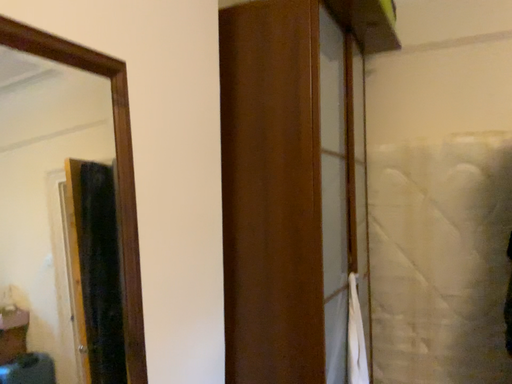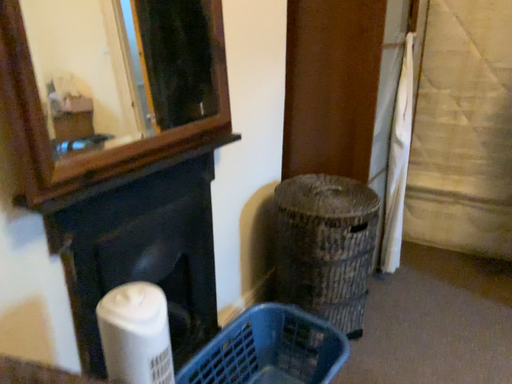
Question: How did the camera likely rotate when shooting the video?

Choices:
 (A) rotated upward
 (B) rotated downward

Answer: (B)